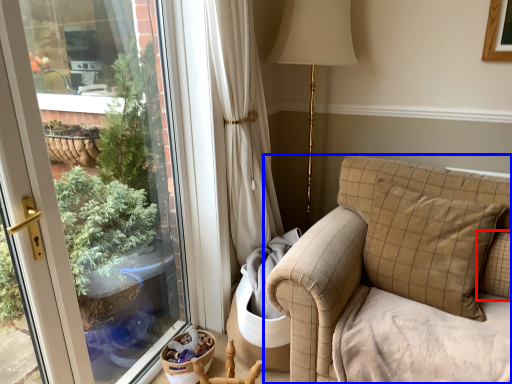
Question: Which point is closer to the camera, pillow (highlighted by a red box) or studio couch (highlighted by a blue box)?

Choices:
 (A) pillow
 (B) studio couch

Answer: (B)